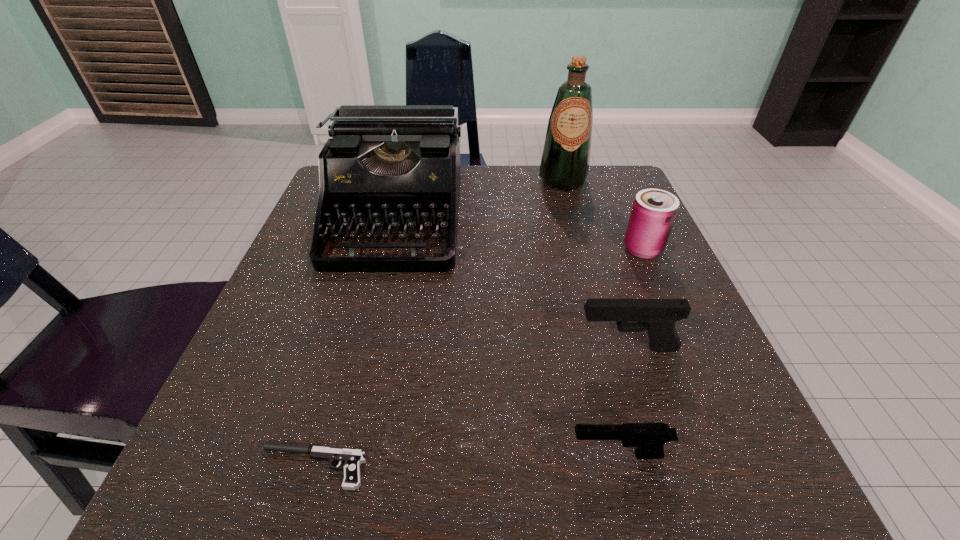
Where is `olive oil`? Image resolution: width=960 pixels, height=540 pixels. olive oil is located at coordinates (564, 166).

At what (x,y) coordinates should I click in order to perform the action: click on the fifth shortest object. Please return your answer as a coordinate pair (x, y). Looking at the image, I should click on (389, 167).

Image resolution: width=960 pixels, height=540 pixels. Find the location of `can`. can is located at coordinates (654, 211).

At what (x,y) coordinates should I click in order to perform the action: click on the tallest pistol. Please return your answer as a coordinate pair (x, y). The image size is (960, 540). Looking at the image, I should click on (658, 316).

Locate an element on the screen. This screenshot has height=540, width=960. the fourth farthest object is located at coordinates (658, 316).

Find the location of a particular element. Image resolution: width=960 pixels, height=540 pixels. the second tallest pistol is located at coordinates (649, 438).

Locate an element on the screen. the shortest object is located at coordinates (352, 458).

The image size is (960, 540). I want to click on the shortest pistol, so click(x=352, y=458).

You are a GUI agent. You are given a task and a screenshot of the screen. Output one action in this format:
    pyautogui.click(x=<x>, y=<y>)
    Task: Click on the vacant position located on the front-facing side of the olive oil
    
    Given the screenshot: What is the action you would take?
    pyautogui.click(x=598, y=309)

At what (x,y) coordinates should I click in order to perform the action: click on free region located 0.380m on the typing side of the fifth shortest object. Please return your answer as a coordinate pair (x, y). The width and height of the screenshot is (960, 540). Looking at the image, I should click on (328, 475).